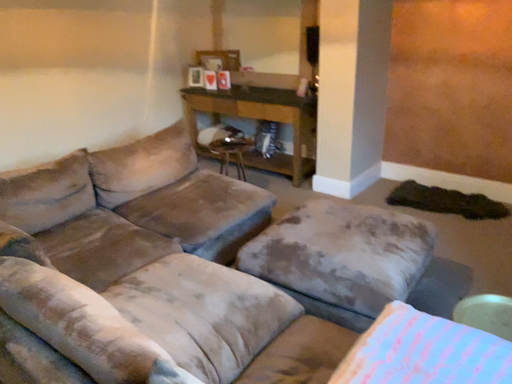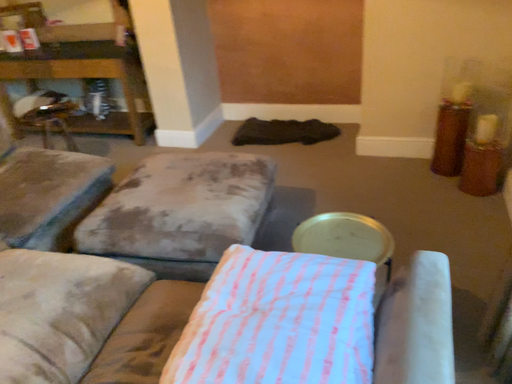
Question: Which way did the camera rotate in the video?

Choices:
 (A) rotated left
 (B) rotated right

Answer: (B)